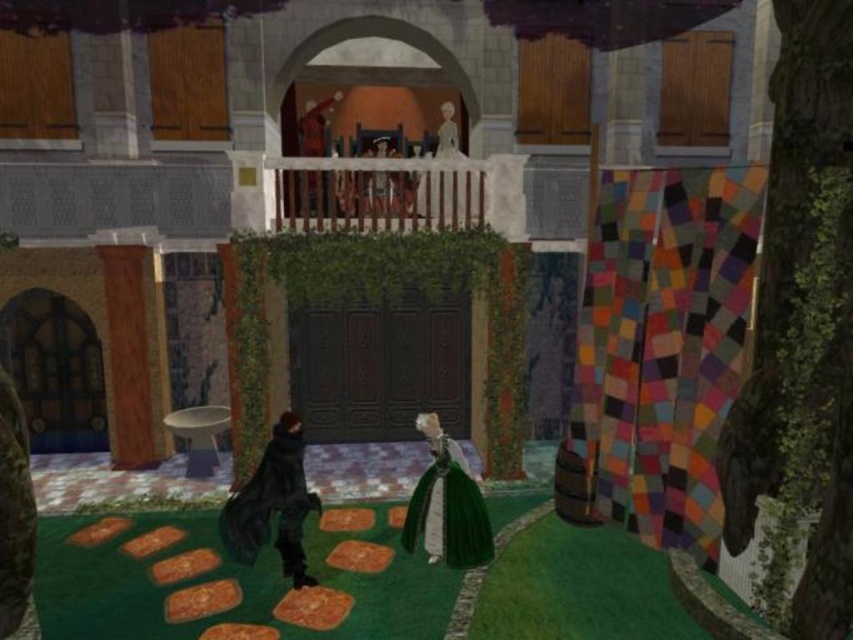
You are a character in the game who needs to reach the smooth red coat at upper center without stepping off the orange stepping stones. The black matte coat at lower left is blocking your path. Can you move around it to reach your destination?

The black matte coat at lower left is below the smooth red coat at upper center, so you can move around it by going either to the left or right of the black matte coat at lower left to reach the smooth red coat at upper center.

You are standing in the courtyard and want to find the wooden pillar at left. Based on the coordinates provided, can you determine if it is closer to the edge or the center of the courtyard?

The wooden pillar at left is located at point (128, 355). Since the coordinates are closer to the edge of the courtyard, it is positioned near the edge rather than the center.

You are standing in the courtyard and want to approach both the black matte coat at lower left and the smooth red coat at upper center. Which coat should you head towards first to reach the one closer to you?

You should head towards the black matte coat at lower left first because it is closer to you than the smooth red coat at upper center.